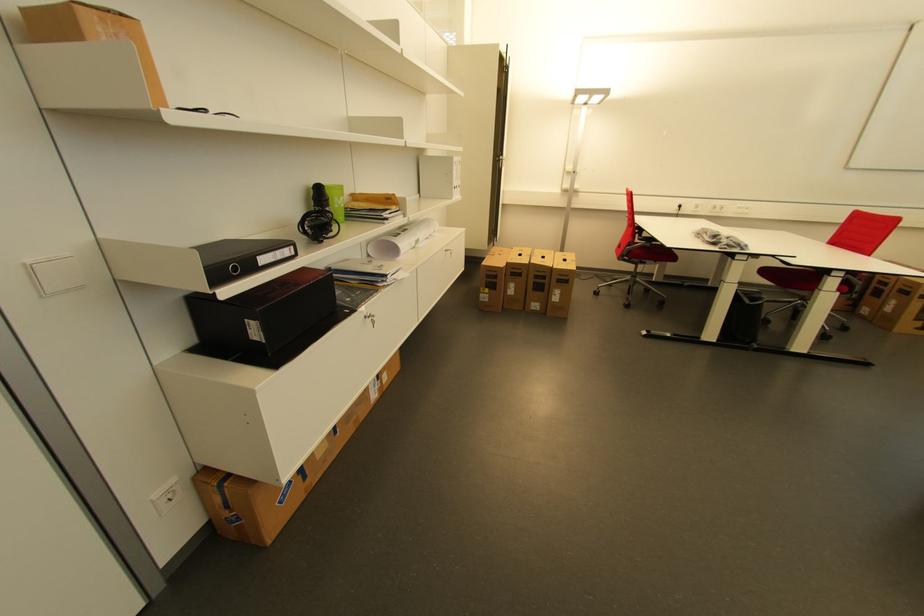
Where would you resting arm the red chair armrest? Please return your answer as a coordinate pair (x, y).

(636, 254)